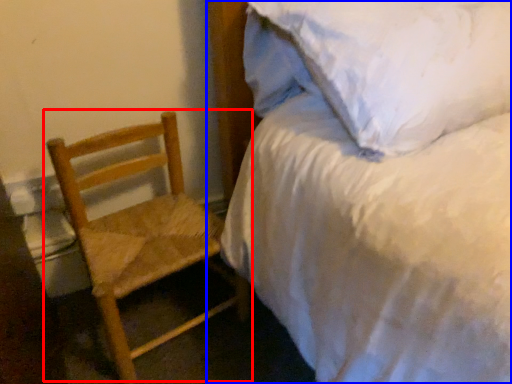
Question: Which object is closer to the camera taking this photo, chair (highlighted by a red box) or bed (highlighted by a blue box)?

Choices:
 (A) chair
 (B) bed

Answer: (B)